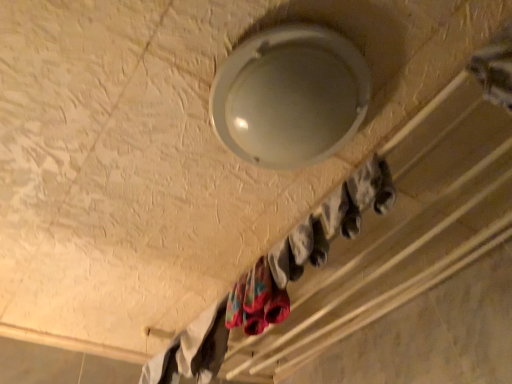
What is the approximate width of multicolored fabric socks at lower center, arranged as the second clothing when viewed from the back?

The width of multicolored fabric socks at lower center, arranged as the second clothing when viewed from the back, is 3.90 inches.

What do you see at coordinates (256, 301) in the screenshot? The width and height of the screenshot is (512, 384). I see `multicolored fabric socks at lower center, arranged as the second clothing when viewed from the back` at bounding box center [256, 301].

Where is `white cotton socks at lower left, positioned as the second clothing in top-to-bottom order`? white cotton socks at lower left, positioned as the second clothing in top-to-bottom order is located at coordinates (192, 350).

Is multicolored fabric socks at lower center, arranged as the second clothing when viewed from the back, at the left side of white matte socks at upper center?

No, multicolored fabric socks at lower center, arranged as the second clothing when viewed from the back, is not to the left of white matte socks at upper center.

Is point (289, 303) closer to camera compared to point (378, 259)?

Yes.

Is multicolored fabric socks at lower center, acting as the 1th clothing starting from the right, taller or shorter than white matte socks at upper center?

Considering their sizes, multicolored fabric socks at lower center, acting as the 1th clothing starting from the right, has more height than white matte socks at upper center.

Is point (141, 374) behind point (414, 137)?

Yes, it is.

Consider the image. From a real-world perspective, which is physically below, white cotton socks at lower left, positioned as the second clothing in top-to-bottom order, or white matte socks at upper center?

From a 3D spatial view, white cotton socks at lower left, positioned as the second clothing in top-to-bottom order, is below.

Is white matte socks at upper center a part of white cotton socks at lower left, the first clothing positioned from the bottom?

No, white cotton socks at lower left, the first clothing positioned from the bottom, does not contain white matte socks at upper center.

Consider the image. Which object is further away from the camera taking this photo, white cotton socks at lower left, arranged as the second clothing when viewed from the right, or white matte socks at upper center?

white cotton socks at lower left, arranged as the second clothing when viewed from the right, is further away from the camera.

Is the position of multicolored fabric socks at lower center, the first clothing from the top, more distant than that of white cotton socks at lower left, arranged as the second clothing when viewed from the right?

No, multicolored fabric socks at lower center, the first clothing from the top, is closer to the camera.

In the scene shown: Considering the relative sizes of multicolored fabric socks at lower center, the first clothing from the top, and white cotton socks at lower left, which is the first clothing in left-to-right order, in the image provided, is multicolored fabric socks at lower center, the first clothing from the top, smaller than white cotton socks at lower left, which is the first clothing in left-to-right order,?

Yes, multicolored fabric socks at lower center, the first clothing from the top, is smaller than white cotton socks at lower left, which is the first clothing in left-to-right order.

From a real-world perspective, who is located lower, multicolored fabric socks at lower center, placed as the 2th clothing when sorted from bottom to top, or white cotton socks at lower left, which is the 2th clothing from front to back?

multicolored fabric socks at lower center, placed as the 2th clothing when sorted from bottom to top, from a real-world perspective.

Does multicolored fabric socks at lower center, which is the second clothing from left to right, have a lesser height compared to white cotton socks at lower left, arranged as the second clothing when viewed from the right?

In fact, multicolored fabric socks at lower center, which is the second clothing from left to right, may be taller than white cotton socks at lower left, arranged as the second clothing when viewed from the right.

Can you confirm if white matte socks at upper center is wider than white cotton socks at lower left, the first clothing positioned from the bottom?

Correct, the width of white matte socks at upper center exceeds that of white cotton socks at lower left, the first clothing positioned from the bottom.

From their relative heights in the image, would you say white matte socks at upper center is taller or shorter than white cotton socks at lower left, which is the first clothing in left-to-right order?

Considering their sizes, white matte socks at upper center has less height than white cotton socks at lower left, which is the first clothing in left-to-right order.

From the picture: What's the angular difference between white matte socks at upper center and white cotton socks at lower left, positioned as the second clothing in top-to-bottom order,'s facing directions?

They differ by 0.693 degrees in their facing directions.

Consider the image. Is white matte socks at upper center to the left or to the right of white cotton socks at lower left, positioned as the second clothing in top-to-bottom order, in the image?

Clearly, white matte socks at upper center is on the right of white cotton socks at lower left, positioned as the second clothing in top-to-bottom order, in the image.

Looking at the image, does white matte socks at upper center seem bigger or smaller compared to multicolored fabric socks at lower center, the 1th clothing viewed from the front?

In the image, white matte socks at upper center appears to be larger than multicolored fabric socks at lower center, the 1th clothing viewed from the front.

The height and width of the screenshot is (384, 512). I want to click on clothing to the right of white matte socks at upper center, so click(x=256, y=301).

Relative to multicolored fabric socks at lower center, which is the second clothing from left to right, is white matte socks at upper center in front or behind?

white matte socks at upper center is in front of multicolored fabric socks at lower center, which is the second clothing from left to right.

Considering the sizes of objects white matte socks at upper center and multicolored fabric socks at lower center, placed as the 2th clothing when sorted from bottom to top, in the image provided, who is taller, white matte socks at upper center or multicolored fabric socks at lower center, placed as the 2th clothing when sorted from bottom to top,?

multicolored fabric socks at lower center, placed as the 2th clothing when sorted from bottom to top.

Which of these two, white cotton socks at lower left, arranged as the first clothing when viewed from the back, or multicolored fabric socks at lower center, the 1th clothing viewed from the front, is wider?

With larger width is white cotton socks at lower left, arranged as the first clothing when viewed from the back.

Is point (201, 360) behind point (264, 267)?

Yes, it is behind point (264, 267).

What's the angular difference between white cotton socks at lower left, arranged as the second clothing when viewed from the right, and multicolored fabric socks at lower center, acting as the 1th clothing starting from the right,'s facing directions?

There is a 11.8-degree angle between the facing directions of white cotton socks at lower left, arranged as the second clothing when viewed from the right, and multicolored fabric socks at lower center, acting as the 1th clothing starting from the right.

From a real-world perspective, which object stands above the other?

In real-world perspective, white cotton socks at lower left, arranged as the second clothing when viewed from the right, is above.

Identify the location of the 2nd clothing positioned below the white matte socks at upper center (from a real-world perspective). (256, 301).

This screenshot has width=512, height=384. I want to click on closet above the white cotton socks at lower left, the first clothing positioned from the bottom (from a real-world perspective), so click(377, 230).

When comparing their distances from white matte socks at upper center, does white cotton socks at lower left, the first clothing positioned from the bottom, or multicolored fabric socks at lower center, the first clothing from the top, seem closer?

white cotton socks at lower left, the first clothing positioned from the bottom.

Estimate the real-world distances between objects in this image. Which object is further from multicolored fabric socks at lower center, placed as the 2th clothing when sorted from bottom to top, white matte socks at upper center or white cotton socks at lower left, arranged as the first clothing when viewed from the back?

white matte socks at upper center.

Looking at the image, which one is located further to white cotton socks at lower left, arranged as the first clothing when viewed from the back, multicolored fabric socks at lower center, arranged as the second clothing when viewed from the back, or white matte socks at upper center?

The object further to white cotton socks at lower left, arranged as the first clothing when viewed from the back, is white matte socks at upper center.

Looking at this image, based on their spatial positions, is white matte socks at upper center or multicolored fabric socks at lower center, the 1th clothing viewed from the front, closer to white cotton socks at lower left, the first clothing positioned from the bottom?

multicolored fabric socks at lower center, the 1th clothing viewed from the front, lies closer to white cotton socks at lower left, the first clothing positioned from the bottom, than the other object.

When comparing their distances from multicolored fabric socks at lower center, placed as the 2th clothing when sorted from bottom to top, does white cotton socks at lower left, which is the first clothing in left-to-right order, or white matte socks at upper center seem further?

white matte socks at upper center is positioned further to the anchor multicolored fabric socks at lower center, placed as the 2th clothing when sorted from bottom to top.

From the image, which object appears to be farther from white matte socks at upper center, multicolored fabric socks at lower center, the first clothing from the top, or white cotton socks at lower left, arranged as the first clothing when viewed from the back?

multicolored fabric socks at lower center, the first clothing from the top, is further to white matte socks at upper center.

Identify the location of clothing between white matte socks at upper center and white cotton socks at lower left, which is the 2th clothing from front to back, in the front-back direction. The image size is (512, 384). (256, 301).